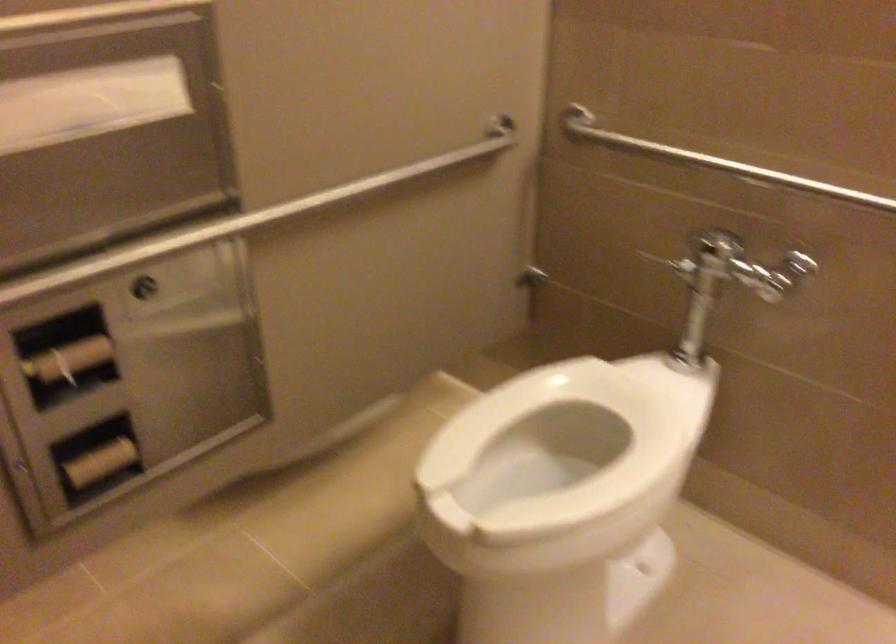
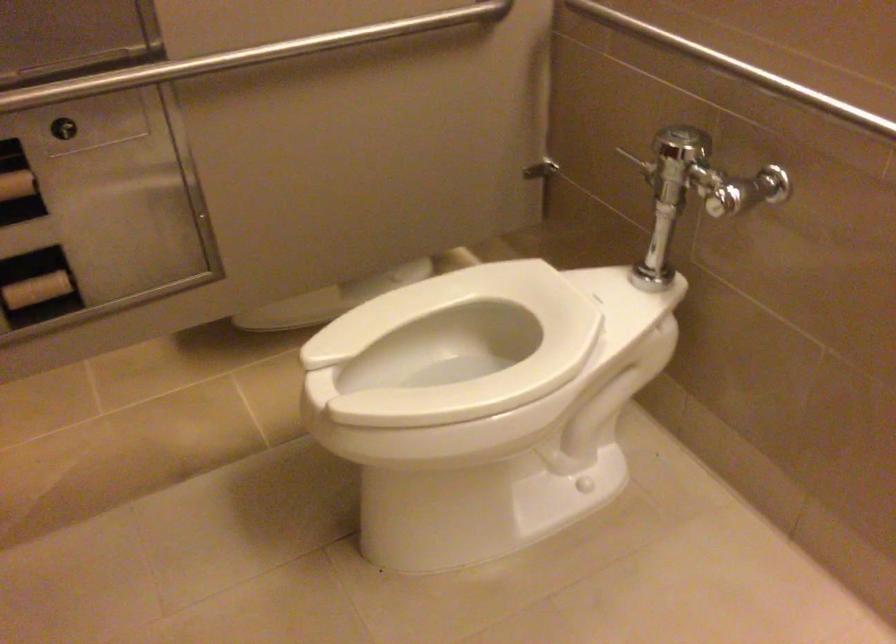
Question: Based on the continuous images, in which direction is the camera rotating? Reply with the corresponding letter.

Choices:
 (A) Left
 (B) Right
 (C) Up
 (D) Down

Answer: (A)